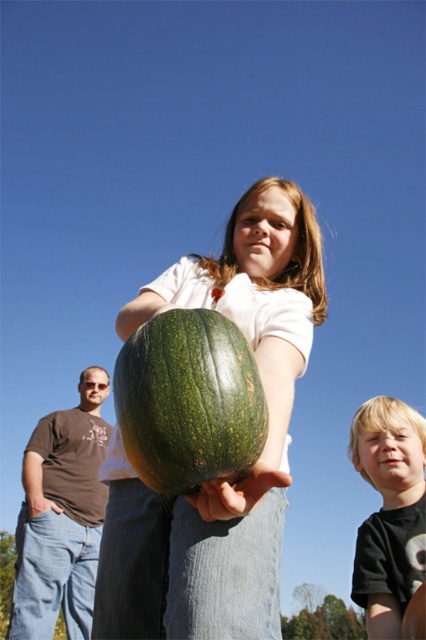
You are trying to decide whether to place a large round table between the green matte pumpkin at center and the blonde hair boy at lower right. The table requires a width of 1.2 meters. Can you fit it between them based on their sizes?

The green matte pumpkin at center is thinner than the blonde hair boy at lower right. Since the pumpkin is thinner, the space between them might be sufficient, but without knowing the exact distance between them, it is uncertain if 1.2 meters can fit. However, since the pumpkin is thinner, it might allow for a wider space. The answer is inconclusive without more information.